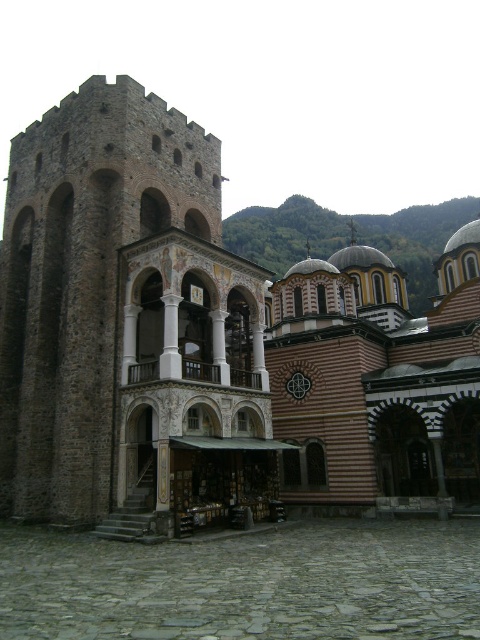
Does brown stone tower at left have a lesser width compared to gray cobblestone courtyard at center?

In fact, brown stone tower at left might be wider than gray cobblestone courtyard at center.

Which is in front, point (357, 392) or point (469, 592)?

Point (469, 592)

Does point (60, 461) come in front of point (457, 570)?

That is False.

This screenshot has height=640, width=480. In order to click on brown stone tower at left in this screenshot , I will do `click(210, 342)`.